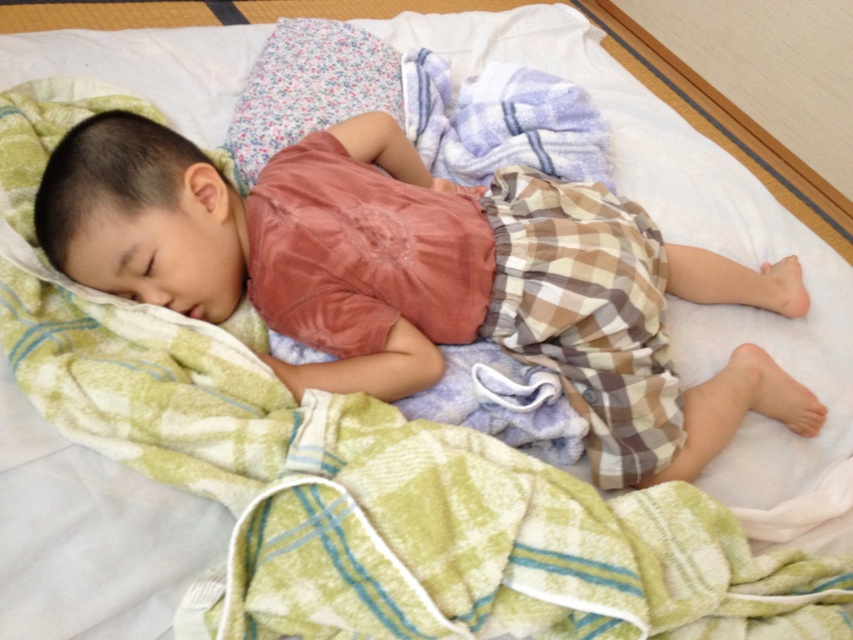
Question: Which object appears farthest from the camera in this image?

Choices:
 (A) matte pink shirt at center
 (B) floral fabric pillow at upper center

Answer: (B)

Question: Is matte pink shirt at center below floral fabric pillow at upper center?

Choices:
 (A) yes
 (B) no

Answer: (A)

Question: Among these points, which one is farthest from the camera?

Choices:
 (A) (331, 189)
 (B) (288, 60)

Answer: (B)

Question: Does matte pink shirt at center have a smaller size compared to floral fabric pillow at upper center?

Choices:
 (A) no
 (B) yes

Answer: (A)

Question: Which object appears closest to the camera in this image?

Choices:
 (A) floral fabric pillow at upper center
 (B) matte pink shirt at center

Answer: (B)

Question: Does matte pink shirt at center have a larger size compared to floral fabric pillow at upper center?

Choices:
 (A) yes
 (B) no

Answer: (A)